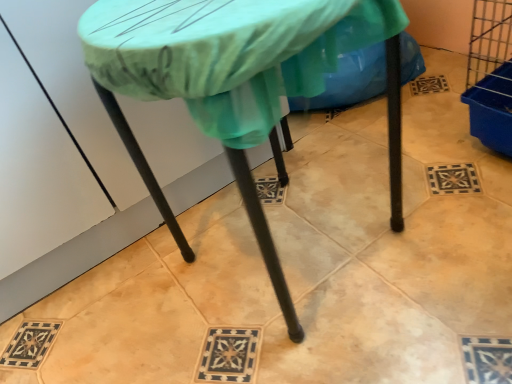
Image resolution: width=512 pixels, height=384 pixels. I want to click on free location to the left of matte green tablecloth at center, so click(x=142, y=300).